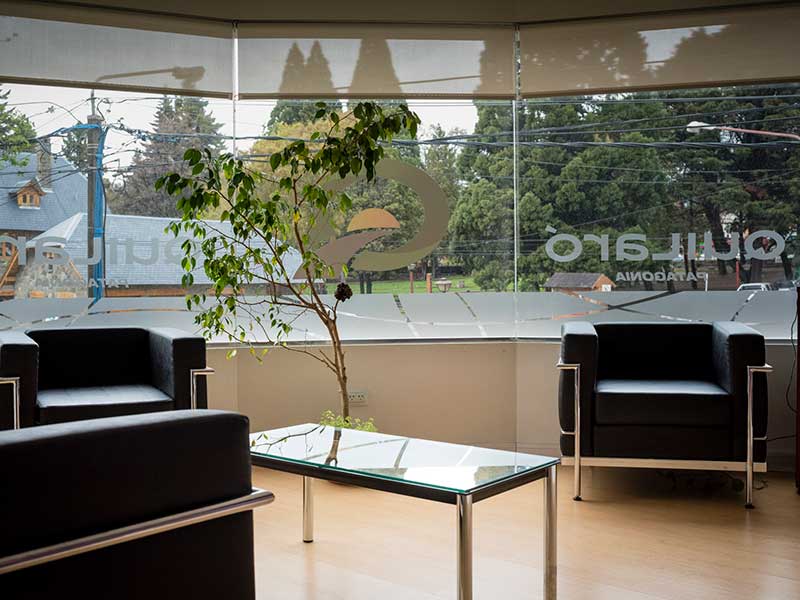
Identify the location of cord. (790, 402).